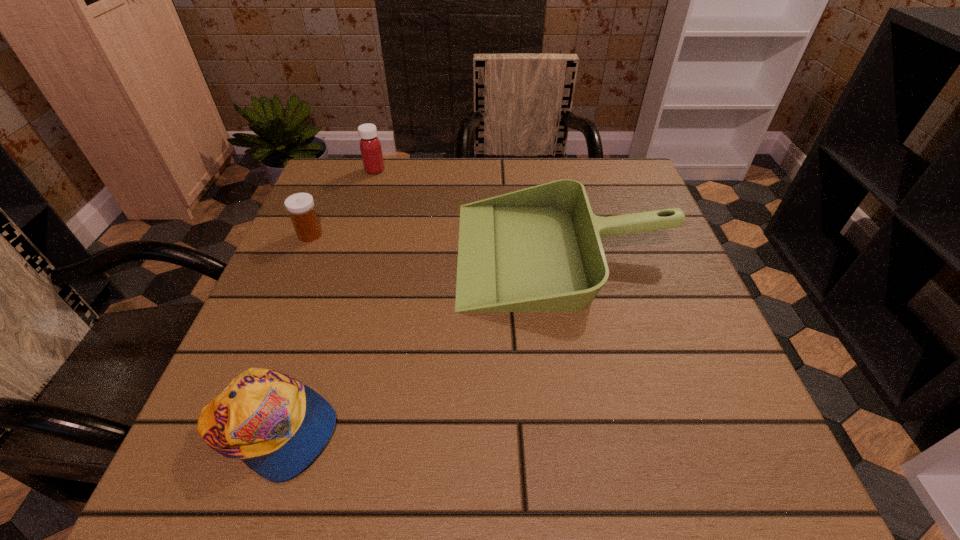
Identify the location of vacant position at the far edge of the desktop. (443, 201).

What are the coordinates of `free location at the left edge` in the screenshot? It's located at (340, 307).

The image size is (960, 540). Find the location of `vacant space at the right edge of the desktop`. vacant space at the right edge of the desktop is located at coordinates click(648, 429).

You are a GUI agent. You are given a task and a screenshot of the screen. Output one action in this format:
    pyautogui.click(x=<x>, y=<y>)
    Task: Click on the vacant space at the far left corner of the desktop
    The width and height of the screenshot is (960, 540).
    Given the screenshot: What is the action you would take?
    pyautogui.click(x=385, y=158)

Image resolution: width=960 pixels, height=540 pixels. In order to click on vacant space at the near left corner of the desktop in this screenshot , I will do 241,477.

Image resolution: width=960 pixels, height=540 pixels. What are the coordinates of `free location at the near right corner` in the screenshot? It's located at (682, 443).

At what (x,y) coordinates should I click in order to perform the action: click on free spot between the cap and the farthest object. Please return your answer as a coordinate pair (x, y). Looking at the image, I should click on pyautogui.click(x=323, y=300).

Locate an element on the screen. Image resolution: width=960 pixels, height=540 pixels. free space that is in between the nearer medicine and the taller medicine is located at coordinates (343, 202).

Find the location of a particular element. Image resolution: width=960 pixels, height=540 pixels. vacant point located between the right medicine and the nearer medicine is located at coordinates (343, 202).

This screenshot has width=960, height=540. In order to click on blank region between the rightmost object and the nearer medicine in this screenshot , I will do [437, 244].